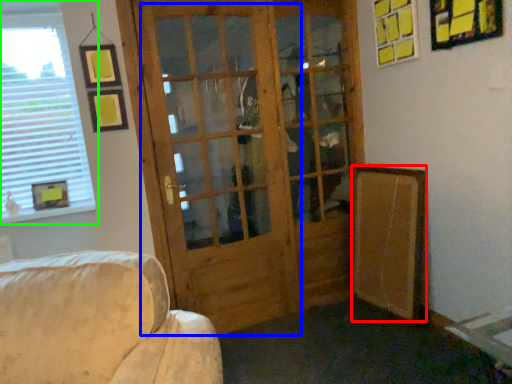
Question: Based on their relative distances, which object is nearer to bulletin board (highlighted by a red box)? Choose from screen door (highlighted by a blue box) and window (highlighted by a green box).

Choices:
 (A) screen door
 (B) window

Answer: (A)